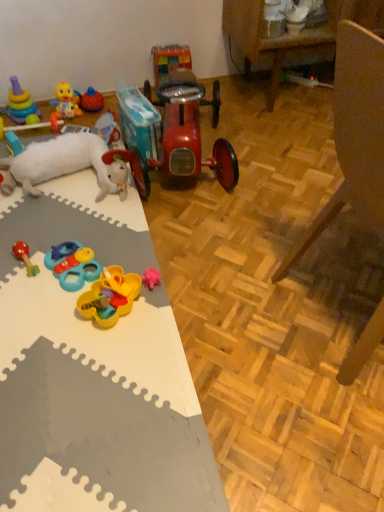
Question: Considering their positions, is stacked plastic rings at upper left, the eleventh toy from the right, located in front of or behind rubber duck at left, marked as the tenth toy in a right-to-left arrangement?

Choices:
 (A) front
 (B) behind

Answer: (B)

Question: Is stacked plastic rings at upper left, the first toy when ordered from left to right, situated inside rubber duck at left, arranged as the second toy when viewed from the left, or outside?

Choices:
 (A) outside
 (B) inside

Answer: (A)

Question: Estimate the real-world distances between objects in this image. Which object is farther from the white foam mat at left?

Choices:
 (A) wooden armchair at lower right
 (B) white plush sheep at left, which appears as the 5th toy when viewed from the left
 (C) rubber duck at center, acting as the fifth toy starting from the right
 (D) shiny red car at center, which ranks as the 11th toy in left-to-right order
 (E) yellow plastic toy at center, positioned as the 9th toy in left-to-right order

Answer: (C)

Question: Based on their relative distances, which object is farther from the stacked plastic rings at upper left, the eleventh toy from the right?

Choices:
 (A) yellow plastic toy at center, positioned as the 9th toy in left-to-right order
 (B) white plush sheep at left, which ranks as the 7th toy in right-to-left order
 (C) yellow rubber duck at upper left, the third toy in the left-to-right sequence
 (D) plastic/soft yellow and blue toy at lower left, the 8th toy positioned from the left
 (E) rubber duck at center, the seventh toy positioned from the left

Answer: (A)